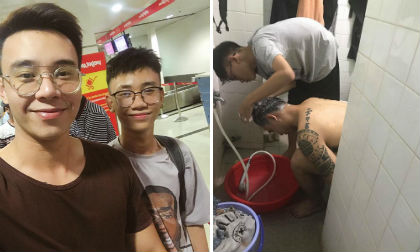
You are a GUI agent. You are given a task and a screenshot of the screen. Output one action in this format:
    pyautogui.click(x=<x>, y=<y>)
    Task: Click on the bathroom floor
    
    Given the screenshot: What is the action you would take?
    pyautogui.click(x=296, y=236)